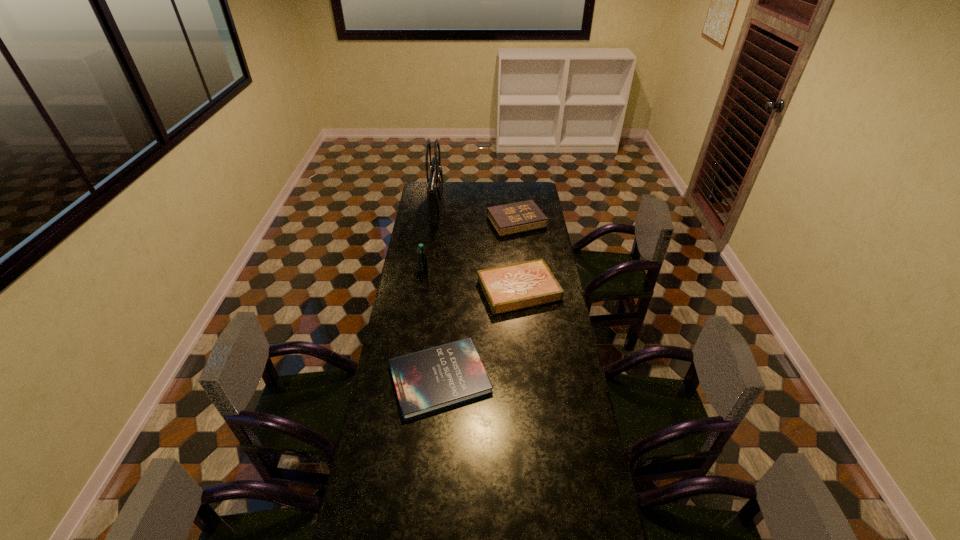
The width and height of the screenshot is (960, 540). Find the location of `free space that satisfies the following two spatial constraints: 1. with an open clasp on the front of the tallest object; 2. on the left side of the farthest hardback book`. free space that satisfies the following two spatial constraints: 1. with an open clasp on the front of the tallest object; 2. on the left side of the farthest hardback book is located at coordinates (435, 222).

Where is `free space that satisfies the following two spatial constraints: 1. on the front side of the water bottle; 2. on the left side of the nearest object`? free space that satisfies the following two spatial constraints: 1. on the front side of the water bottle; 2. on the left side of the nearest object is located at coordinates (408, 379).

I want to click on free space that satisfies the following two spatial constraints: 1. on the back side of the second farthest hardback book; 2. with an open clasp on the front of the tallest object, so click(x=511, y=208).